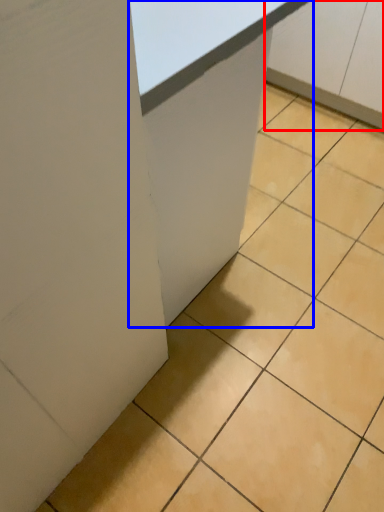
Question: Which point is further to the camera, cabinetry (highlighted by a red box) or table (highlighted by a blue box)?

Choices:
 (A) cabinetry
 (B) table

Answer: (A)